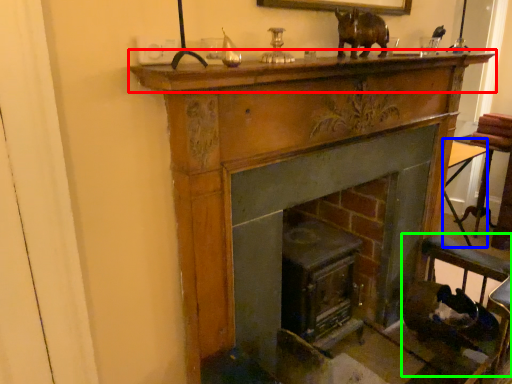
Question: Considering the real-world distances, which object is farthest from mantle (highlighted by a red box)? table (highlighted by a blue box) or rocking chair (highlighted by a green box)?

Choices:
 (A) table
 (B) rocking chair

Answer: (A)